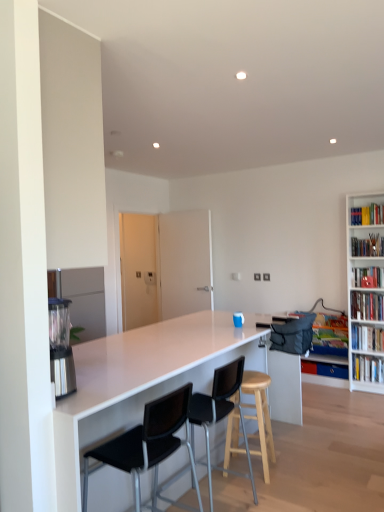
Find the location of a particular element. This screenshot has height=512, width=384. vacant space to the right of light wood stool at center is located at coordinates (295, 465).